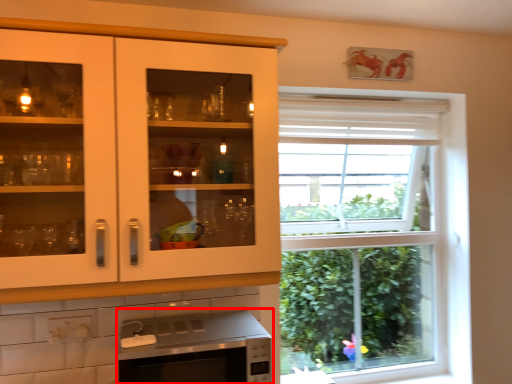
Question: From the image's perspective, where is microwave oven (annotated by the red box) located relative to cabinetry?

Choices:
 (A) below
 (B) above

Answer: (A)